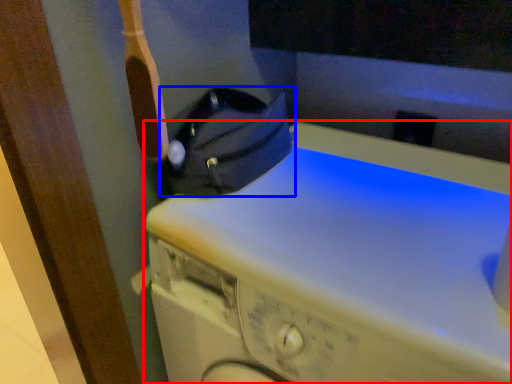
Question: Among these objects, which one is farthest to the camera, washing machine (highlighted by a red box) or bag (highlighted by a blue box)?

Choices:
 (A) washing machine
 (B) bag

Answer: (B)